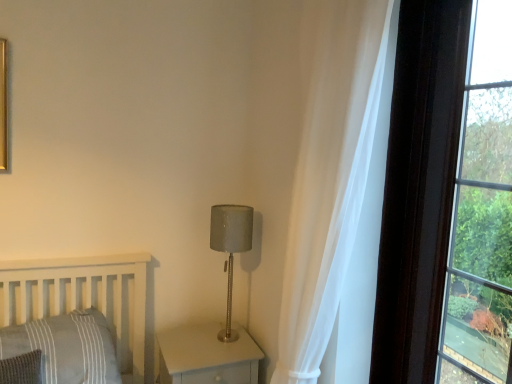
The image size is (512, 384). What are the coordinates of `free area behind satin gray lampshade at center` in the screenshot? It's located at (216, 329).